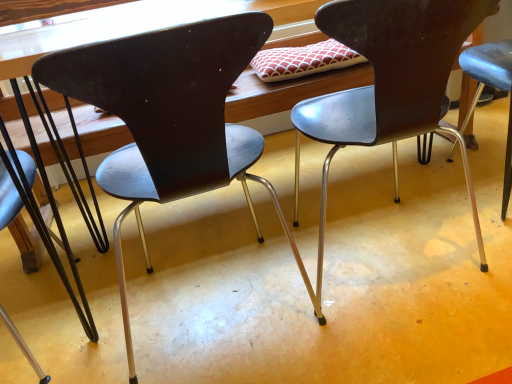
Question: Is the surface of metallic dark brown chair at left, the 3th chair in the right-to-left sequence, in direct contact with metallic black chair at center, which is the 3th chair from left to right?

Choices:
 (A) yes
 (B) no

Answer: (B)

Question: From a real-world perspective, is metallic dark brown chair at left, which is the 1th chair in left-to-right order, on metallic black chair at center, acting as the 1th chair starting from the right?

Choices:
 (A) yes
 (B) no

Answer: (B)

Question: Does metallic dark brown chair at left, which is the 1th chair in left-to-right order, have a lesser height compared to metallic black chair at center, which is the 3th chair from left to right?

Choices:
 (A) no
 (B) yes

Answer: (B)

Question: Could metallic black chair at center, acting as the 1th chair starting from the right, be considered to be inside metallic dark brown chair at left, the 3th chair in the right-to-left sequence?

Choices:
 (A) no
 (B) yes

Answer: (A)

Question: Considering the relative positions of metallic dark brown chair at left, the 3th chair in the right-to-left sequence, and metallic black chair at center, acting as the 1th chair starting from the right, in the image provided, is metallic dark brown chair at left, the 3th chair in the right-to-left sequence, behind metallic black chair at center, acting as the 1th chair starting from the right,?

Choices:
 (A) yes
 (B) no

Answer: (A)

Question: From a real-world perspective, is matte black chair at center, the second chair viewed from the right, physically located above or below metallic dark brown chair at left, the 3th chair in the right-to-left sequence?

Choices:
 (A) above
 (B) below

Answer: (A)

Question: Looking at their shapes, would you say matte black chair at center, the second chair viewed from the right, is wider or thinner than metallic dark brown chair at left, the 3th chair in the right-to-left sequence?

Choices:
 (A) thin
 (B) wide

Answer: (B)

Question: Considering the positions of point (175, 165) and point (30, 206), is point (175, 165) closer or farther from the camera than point (30, 206)?

Choices:
 (A) farther
 (B) closer

Answer: (B)

Question: Is matte black chair at center, the second chair viewed from the right, taller or shorter than metallic dark brown chair at left, which is the 1th chair in left-to-right order?

Choices:
 (A) short
 (B) tall

Answer: (B)

Question: Is metallic black chair at center, which is the 3th chair from left to right, situated inside metallic dark brown chair at left, the 3th chair in the right-to-left sequence, or outside?

Choices:
 (A) inside
 (B) outside

Answer: (B)

Question: Is metallic black chair at center, acting as the 1th chair starting from the right, in front of or behind metallic dark brown chair at left, which is the 1th chair in left-to-right order, in the image?

Choices:
 (A) behind
 (B) front

Answer: (B)

Question: Considering the relative positions of metallic black chair at center, acting as the 1th chair starting from the right, and metallic dark brown chair at left, which is the 1th chair in left-to-right order, in the image provided, is metallic black chair at center, acting as the 1th chair starting from the right, to the left or to the right of metallic dark brown chair at left, which is the 1th chair in left-to-right order,?

Choices:
 (A) left
 (B) right

Answer: (B)

Question: Considering the positions of metallic black chair at center, which is the 3th chair from left to right, and metallic dark brown chair at left, which is the 1th chair in left-to-right order, in the image, is metallic black chair at center, which is the 3th chair from left to right, bigger or smaller than metallic dark brown chair at left, which is the 1th chair in left-to-right order,?

Choices:
 (A) big
 (B) small

Answer: (A)

Question: Is matte black chair at center, the second chair viewed from the right, bigger or smaller than metallic black chair at center, acting as the 1th chair starting from the right?

Choices:
 (A) big
 (B) small

Answer: (A)

Question: Relative to metallic black chair at center, which is the 3th chair from left to right, is matte black chair at center, the second chair viewed from the right, in front or behind?

Choices:
 (A) front
 (B) behind

Answer: (A)